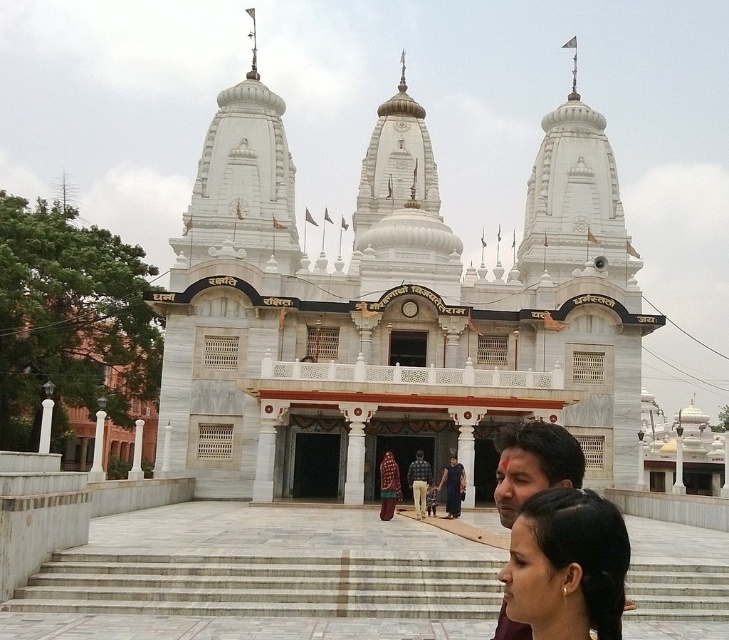
Is white marble hindu temple at center closer to camera compared to black hair at lower center?

No, it is not.

In the scene shown: Does white marble hindu temple at center have a greater width compared to black hair at lower center?

Indeed, white marble hindu temple at center has a greater width compared to black hair at lower center.

Between point (545, 368) and point (612, 512), which one is positioned behind?

Point (545, 368)

I want to click on white marble hindu temple at center, so click(x=389, y=310).

Is point (475, 572) in front of point (418, 477)?

That is True.

Looking at this image, does white marble stairs at center come in front of brown leather jacket at center?

That is True.

Is point (703, 586) positioned in front of point (416, 497)?

Yes, it is in front of point (416, 497).

Image resolution: width=729 pixels, height=640 pixels. I want to click on white marble stairs at center, so click(265, 588).

Can you confirm if dark brown fabric dress at center is positioned to the right of brown leather jacket at center?

No, dark brown fabric dress at center is not to the right of brown leather jacket at center.

Where is `dark brown fabric dress at center`? The width and height of the screenshot is (729, 640). dark brown fabric dress at center is located at coordinates (421, 483).

Who is more distant from viewer, [382,481] or [413,470]?

Point [413,470]

Image resolution: width=729 pixels, height=640 pixels. In order to click on dark brown fabric dress at center in this screenshot , I will do `click(421, 483)`.